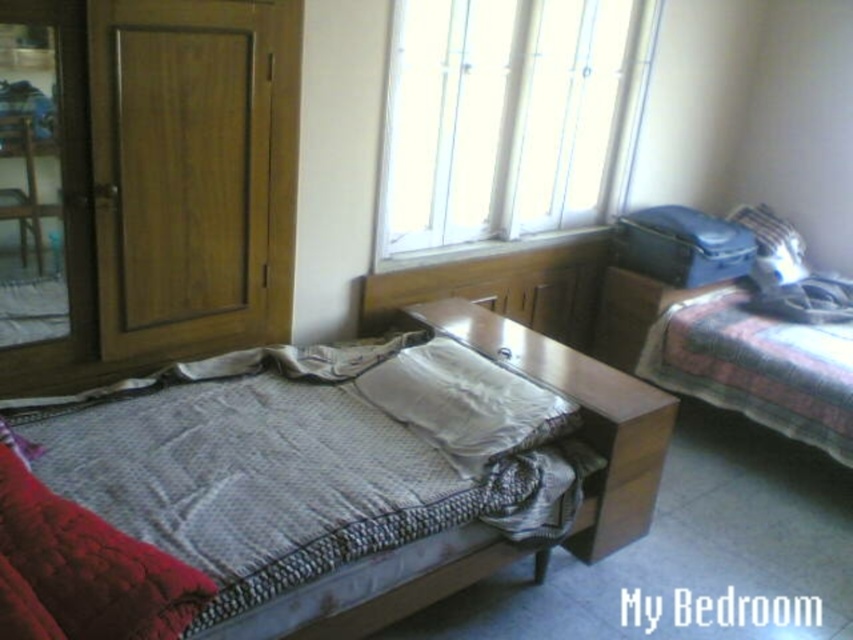
You are standing in the bedroom and want to exit through the wooden door at left. If your height is 1.7 meters, can you walk through the doorway without bending down?

The distance between the wooden door at left and the viewer is 1.71 meters. Since your height is 1.7 meters, you can walk through the doorway without bending down as the height is sufficient.

You are organizing a room and need to place a new decorative item. You have a small statue that needs to be placed on top of either the white quilted bed at center or the white soft pillow at center. Based on their positions, which object can the statue be safely placed on?

The statue can be safely placed on the white soft pillow at center because the white quilted bed at center is positioned under it, meaning the pillow is above the bed and likely a more stable surface for the statue.

You are standing in the bedroom and want to exit through the wooden door at left. However, the white quilted bed at center is blocking your path. Can you walk around the bed to reach the door without moving the bed?

The wooden door at left is located above the white quilted bed at center, which means the door is positioned higher up in the room. Since the door is above the bed, you can walk around the bed to reach the door without moving it.